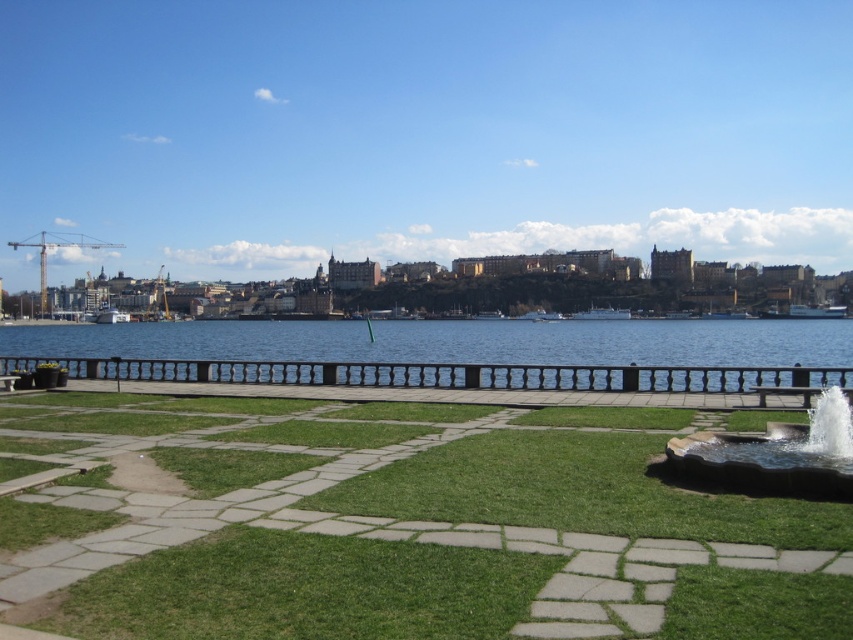
Question: Among these objects, which one is nearest to the camera?

Choices:
 (A) blue water at center
 (B) green grass at center
 (C) smooth stone fountain at lower right

Answer: (B)

Question: Can you confirm if green grass at center is positioned above smooth stone fountain at lower right?

Choices:
 (A) no
 (B) yes

Answer: (A)

Question: Can you confirm if green grass at center is positioned to the left of smooth stone fountain at lower right?

Choices:
 (A) yes
 (B) no

Answer: (A)

Question: Which point appears closest to the camera in this image?

Choices:
 (A) (30, 333)
 (B) (589, 595)

Answer: (B)

Question: Which is farther from the smooth stone fountain at lower right?

Choices:
 (A) green grass at center
 (B) blue water at center

Answer: (B)

Question: Is green grass at center thinner than smooth stone fountain at lower right?

Choices:
 (A) yes
 (B) no

Answer: (B)